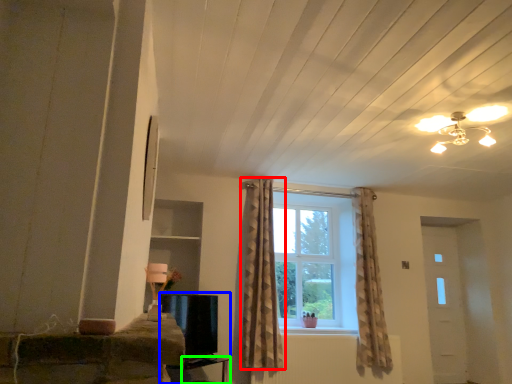
Question: Based on their relative distances, which object is farther from curtain (highlighted by a red box)? Choose from entertainment center (highlighted by a blue box) and table (highlighted by a green box).

Choices:
 (A) entertainment center
 (B) table

Answer: (B)